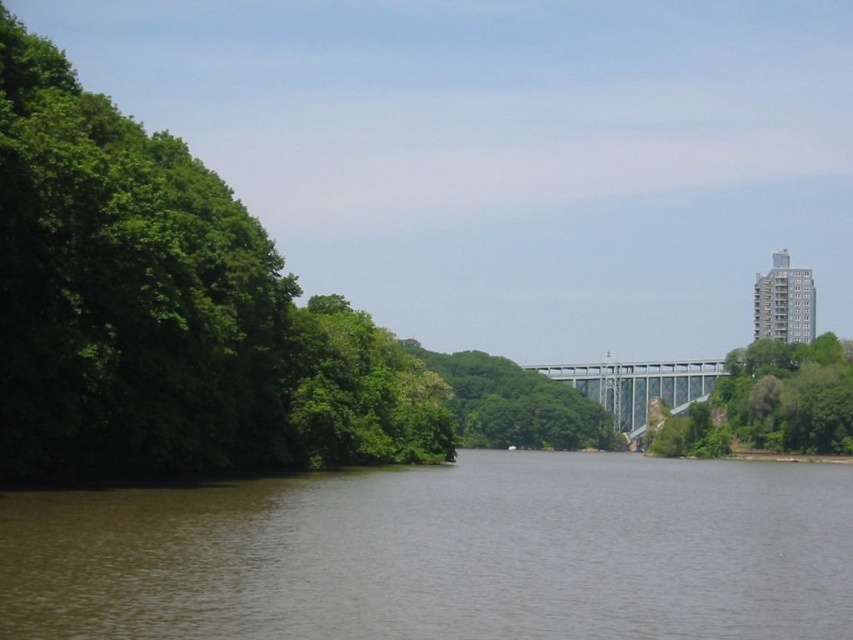
Question: Is brown water at center smaller than green leafy tree at right?

Choices:
 (A) yes
 (B) no

Answer: (B)

Question: Is brown water at center bigger than metallic gray bridge at center?

Choices:
 (A) yes
 (B) no

Answer: (A)

Question: Which point is farther to the camera?

Choices:
 (A) green leafy tree at right
 (B) brown water at center

Answer: (A)

Question: Among these objects, which one is nearest to the camera?

Choices:
 (A) brown water at center
 (B) metallic gray bridge at center
 (C) green leafy trees at left
 (D) green leafy tree at right

Answer: (A)

Question: Which object is positioned farthest from the green leafy tree at right?

Choices:
 (A) green leafy trees at left
 (B) brown water at center

Answer: (A)

Question: Can you confirm if green leafy trees at left is positioned to the right of metallic gray bridge at center?

Choices:
 (A) yes
 (B) no

Answer: (B)